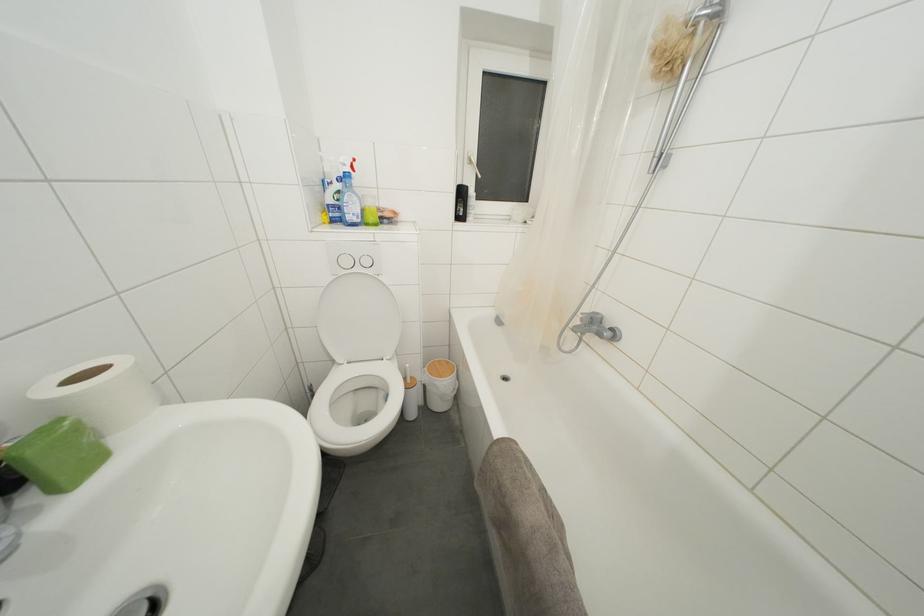
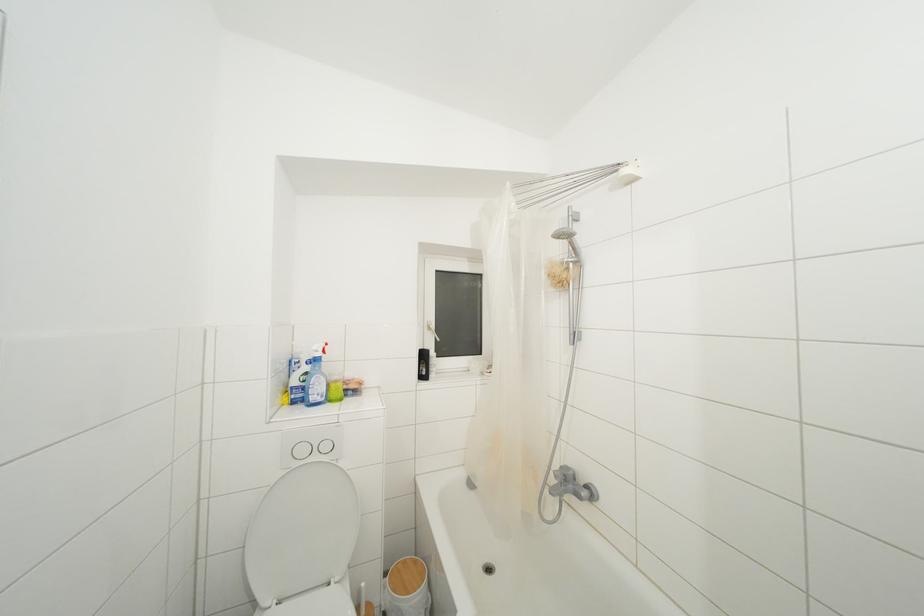
The point at (475,167) is marked in the first image. Where is the corresponding point in the second image?

(433, 333)